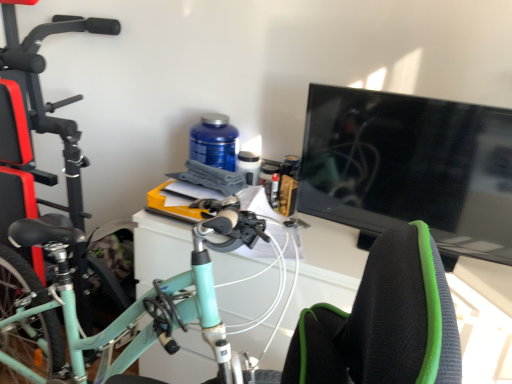
Question: Is white glossy computer desk at center at the left side of mint green matte bicycle at left?

Choices:
 (A) yes
 (B) no

Answer: (B)

Question: Considering the relative positions of white glossy computer desk at center and mint green matte bicycle at left in the image provided, is white glossy computer desk at center behind mint green matte bicycle at left?

Choices:
 (A) no
 (B) yes

Answer: (A)

Question: Does white glossy computer desk at center turn towards mint green matte bicycle at left?

Choices:
 (A) no
 (B) yes

Answer: (A)

Question: Is white glossy computer desk at center smaller than mint green matte bicycle at left?

Choices:
 (A) yes
 (B) no

Answer: (A)

Question: From the image's perspective, is white glossy computer desk at center under mint green matte bicycle at left?

Choices:
 (A) no
 (B) yes

Answer: (B)

Question: Can mint green matte bicycle at left be found inside white glossy computer desk at center?

Choices:
 (A) no
 (B) yes

Answer: (A)

Question: Is white glossy computer desk at center to the right of black glossy tv at right from the viewer's perspective?

Choices:
 (A) no
 (B) yes

Answer: (A)

Question: Is white glossy computer desk at center not within black glossy tv at right?

Choices:
 (A) yes
 (B) no

Answer: (A)

Question: From the image's perspective, is white glossy computer desk at center on black glossy tv at right?

Choices:
 (A) no
 (B) yes

Answer: (A)

Question: Is black glossy tv at right completely or partially inside white glossy computer desk at center?

Choices:
 (A) yes
 (B) no

Answer: (B)

Question: Considering the relative positions of white glossy computer desk at center and black glossy tv at right in the image provided, is white glossy computer desk at center to the left of black glossy tv at right from the viewer's perspective?

Choices:
 (A) yes
 (B) no

Answer: (A)

Question: Is white glossy computer desk at center bigger than black glossy tv at right?

Choices:
 (A) no
 (B) yes

Answer: (B)

Question: From the image's perspective, would you say black glossy tv at right is shown under white glossy computer desk at center?

Choices:
 (A) yes
 (B) no

Answer: (B)